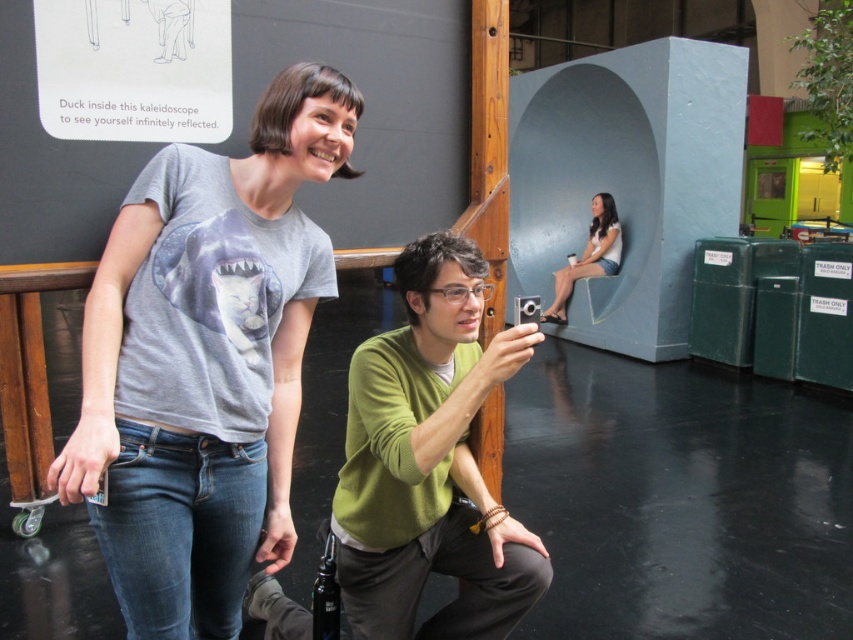
Question: Based on their relative distances, which object is farther from the white matte shirt at upper center?

Choices:
 (A) green matte sweater at center
 (B) gray matte t-shirt at upper left

Answer: (B)

Question: Can you confirm if green matte sweater at center is positioned above white matte shirt at upper center?

Choices:
 (A) yes
 (B) no

Answer: (B)

Question: Does green matte sweater at center appear over white matte shirt at upper center?

Choices:
 (A) no
 (B) yes

Answer: (A)

Question: Is green matte sweater at center thinner than white matte shirt at upper center?

Choices:
 (A) yes
 (B) no

Answer: (A)

Question: Which is nearer to the green matte sweater at center?

Choices:
 (A) white matte shirt at upper center
 (B) gray matte t-shirt at upper left

Answer: (B)

Question: Which object is the closest to the green matte sweater at center?

Choices:
 (A) gray matte t-shirt at upper left
 (B) white matte shirt at upper center

Answer: (A)